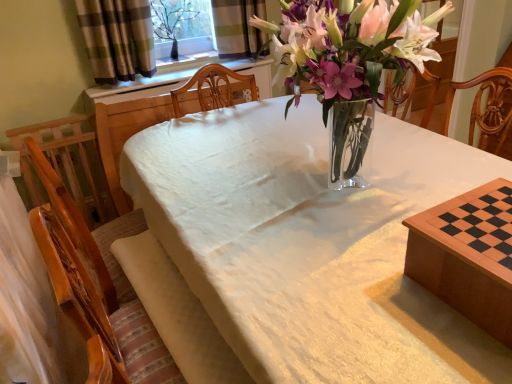
Question: In terms of width, does wooden chessboard at lower right, the 1th table positioned from the back, look wider or thinner when compared to clear glass vase at upper center?

Choices:
 (A) wide
 (B) thin

Answer: (A)

Question: From the image's perspective, is wooden chessboard at lower right, the 1th table positioned from the back, positioned above or below clear glass vase at upper center?

Choices:
 (A) above
 (B) below

Answer: (B)

Question: Which object is the farthest from the wooden chessboard at lower right, the 1th table positioned from the back?

Choices:
 (A) clear glass vase at upper center
 (B) white cloth at center, which appears as the second table when viewed from the back
 (C) plaid fabric curtain at upper left

Answer: (A)

Question: Considering the real-world distances, which object is farthest from the white cloth at center, the first table when ordered from front to back?

Choices:
 (A) clear glass vase at upper center
 (B) plaid fabric curtain at upper left
 (C) wooden chessboard at lower right, the 1th table positioned from the back

Answer: (A)